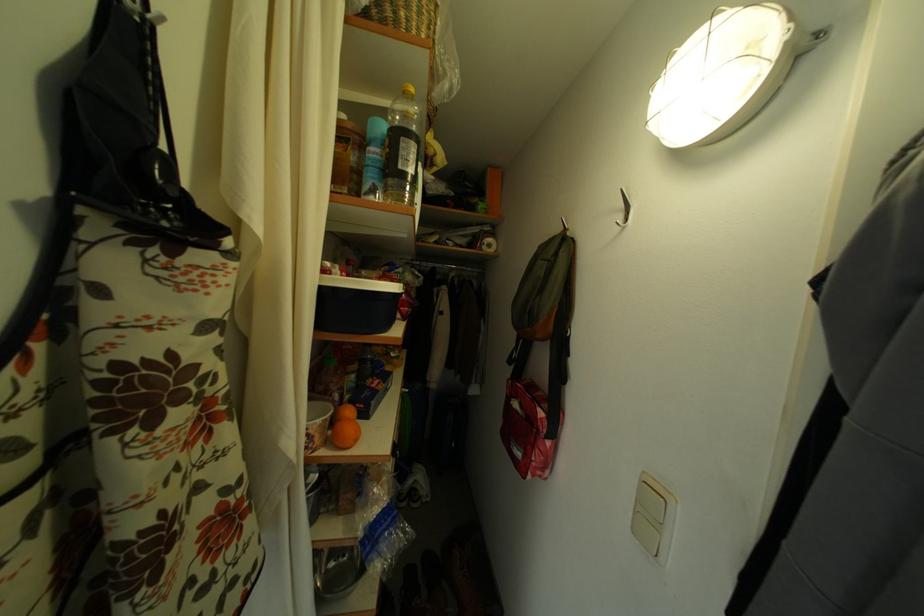
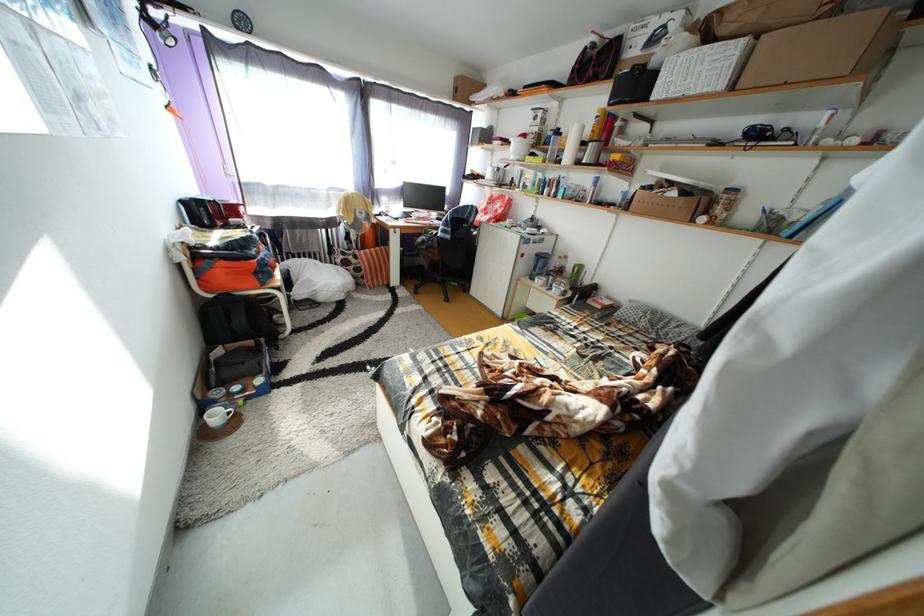
First-person continuous shooting, in which direction is the camera rotating?

The camera's rotation is toward left-down.